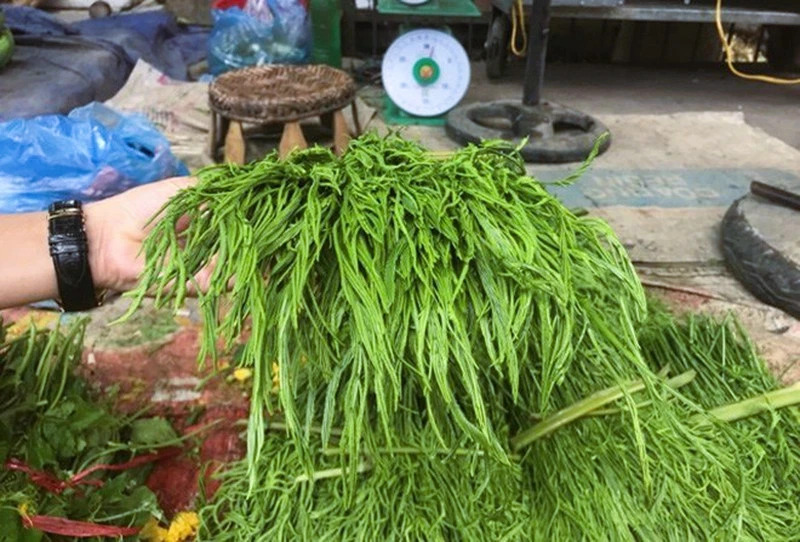
The height and width of the screenshot is (542, 800). I want to click on metal pole stand, so click(534, 78).